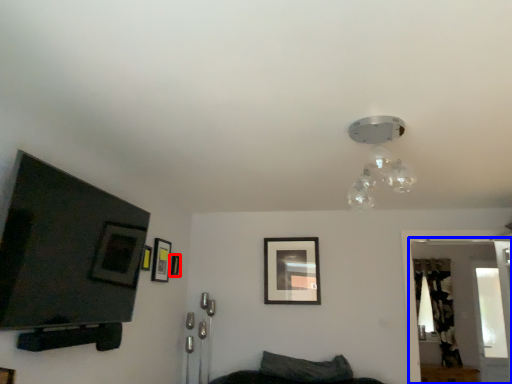
Question: Which of the following is the farthest to the observer, picture frame (highlighted by a red box) or glass door (highlighted by a blue box)?

Choices:
 (A) picture frame
 (B) glass door

Answer: (A)